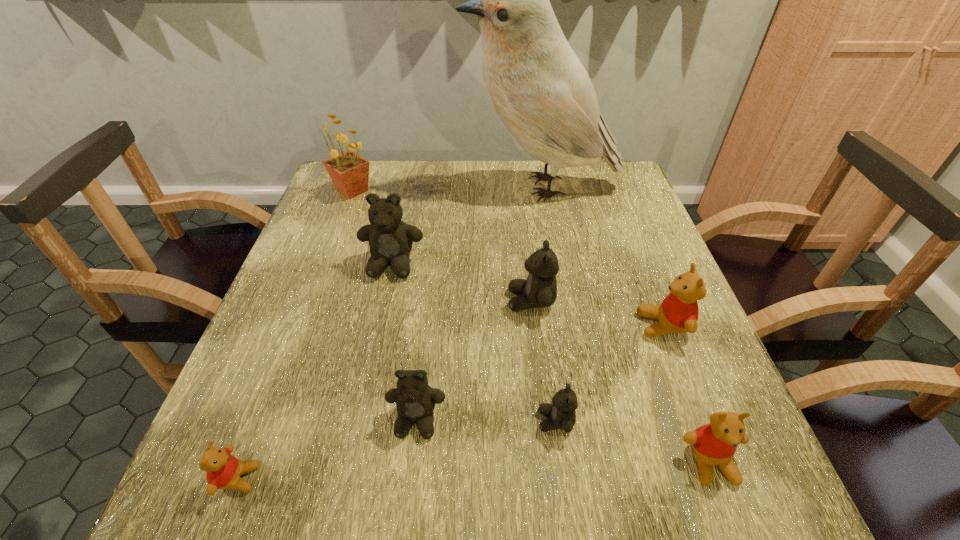
This screenshot has height=540, width=960. Identify the location of parakeet. (536, 84).

The width and height of the screenshot is (960, 540). I want to click on the tallest object, so click(x=536, y=84).

Locate an element on the screen. Image resolution: width=960 pixels, height=540 pixels. sunflower is located at coordinates (349, 172).

Where is `the third tallest object`? This screenshot has width=960, height=540. the third tallest object is located at coordinates (390, 239).

At what (x,y) coordinates should I click in order to perform the action: click on the biggest brown teddy bear. Please return your answer as a coordinate pair (x, y). Looking at the image, I should click on (390, 239).

Identify the location of the second biggest brown teddy bear. (539, 290).

The height and width of the screenshot is (540, 960). Identify the location of the farthest red teddy bear. (678, 313).

Locate an element on the screen. the second smallest brown teddy bear is located at coordinates (415, 400).

Where is `the second smallest red teddy bear`? the second smallest red teddy bear is located at coordinates (715, 443).

Where is `the smallest brown teddy bear`? The height and width of the screenshot is (540, 960). the smallest brown teddy bear is located at coordinates (561, 414).